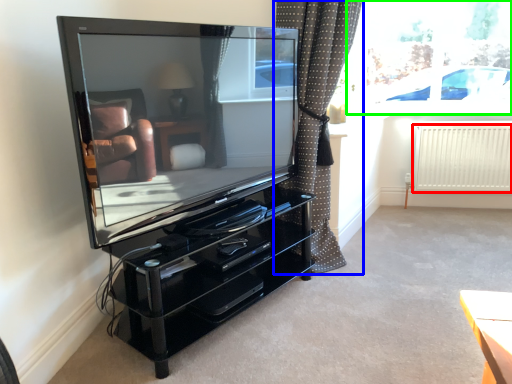
Question: Which object is positioned farthest from radiator (highlighted by a red box)? Select from curtain (highlighted by a blue box) and window screen (highlighted by a green box).

Choices:
 (A) curtain
 (B) window screen

Answer: (A)